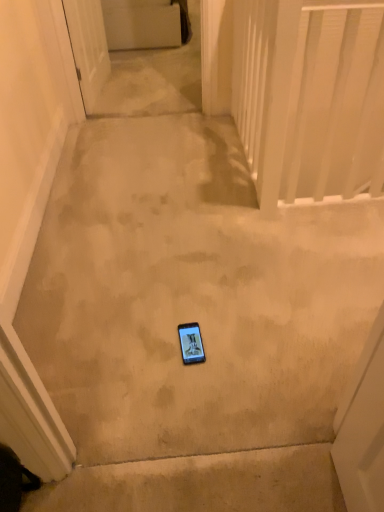
This screenshot has width=384, height=512. What are the coordinates of `free location to the right of white glossy door at upper left` in the screenshot? It's located at (151, 86).